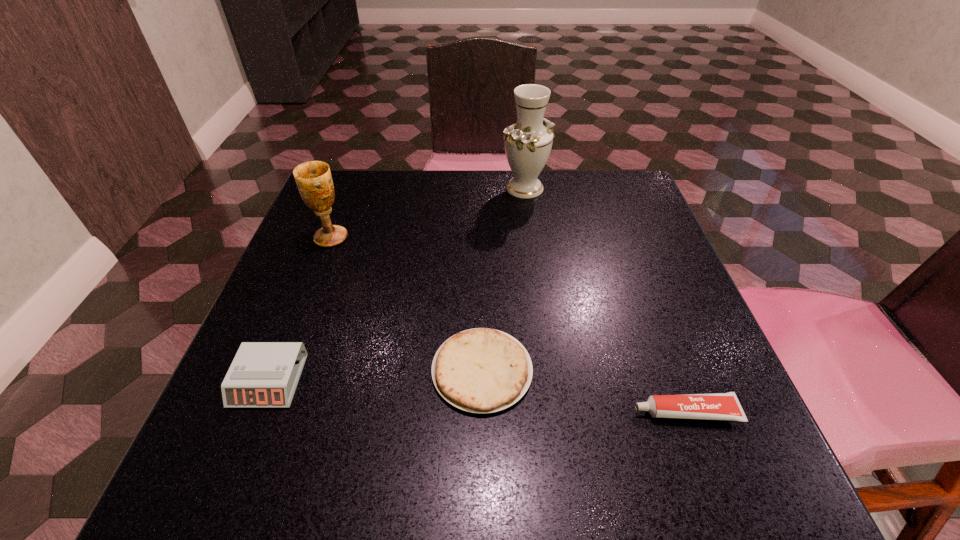
You are a GUI agent. You are given a task and a screenshot of the screen. Output one action in this format:
    pyautogui.click(x=<x>, y=<y>)
    Task: Click on the free space located on the back of the third shortest object
    
    Given the screenshot: What is the action you would take?
    pyautogui.click(x=307, y=285)

Identify the location of free space located 0.080m at the nozzle of the rightmost object. (582, 412).

You are a GUI agent. You are given a task and a screenshot of the screen. Output one action in this format:
    pyautogui.click(x=<x>, y=<y>)
    Task: Click on the vacant area located 0.080m at the nozzle of the rightmost object
    
    Given the screenshot: What is the action you would take?
    pyautogui.click(x=582, y=412)

This screenshot has height=540, width=960. Identify the location of vacant space situated at the nozzle of the rightmost object. (524, 412).

This screenshot has width=960, height=540. Identify the location of free space located 0.320m on the back of the tortilla. (482, 224).

Where is `object present at the far edge`? This screenshot has height=540, width=960. object present at the far edge is located at coordinates (528, 143).

Identify the location of chalice that is at the left edge. (314, 181).

Where is `alarm clock at the left edge`? The width and height of the screenshot is (960, 540). alarm clock at the left edge is located at coordinates (263, 374).

Identify the location of object present at the right edge. The image size is (960, 540). (716, 406).

I want to click on free space at the far edge, so click(427, 203).